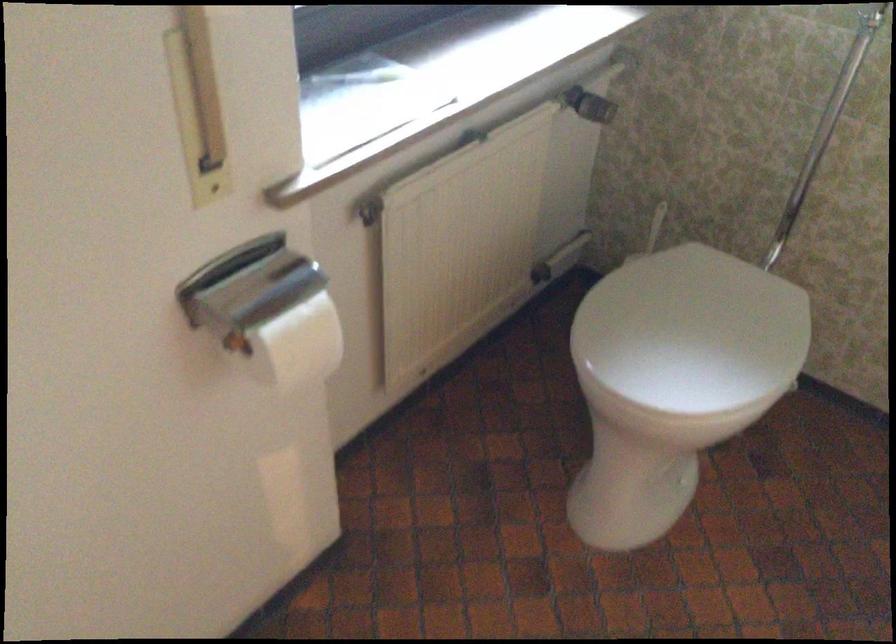
What do you see at coordinates (692, 330) in the screenshot? I see `a toilet lid` at bounding box center [692, 330].